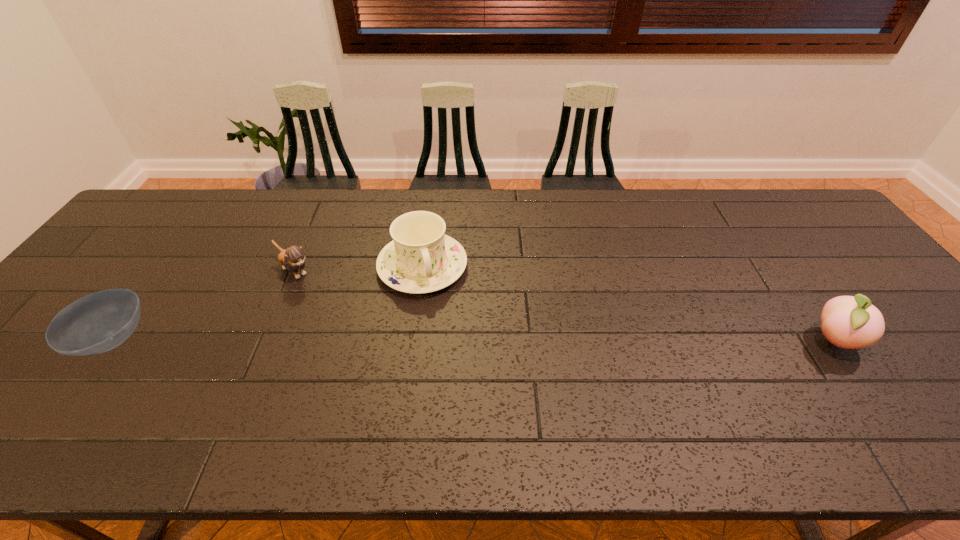
The height and width of the screenshot is (540, 960). What are the coordinates of `free space that is in between the third object from left to right and the kitten` in the screenshot? It's located at (359, 269).

Identify the location of free space between the peach and the kitten. Image resolution: width=960 pixels, height=540 pixels. (564, 306).

Find the location of `object that is the third nearest to the chinaware`. object that is the third nearest to the chinaware is located at coordinates (851, 322).

Select which object is the third closest to the peach. Please provide its 2D coordinates. Your answer should be formatted as a tuple, i.e. [(x, y)], where the tuple contains the x and y coordinates of a point satisfying the conditions above.

[(99, 322)]

Image resolution: width=960 pixels, height=540 pixels. What are the coordinates of `vacant area that satisfies the following two spatial constraints: 1. on the back side of the third object from left to right; 2. on the right side of the leftmost object` in the screenshot? It's located at (166, 267).

At what (x,y) coordinates should I click in order to perform the action: click on free location that satisfies the following two spatial constraints: 1. on the front side of the chinaware; 2. on the left side of the rightmost object. Please return your answer as a coordinate pair (x, y). Looking at the image, I should click on (413, 340).

Find the location of `vacant space that satisfies the following two spatial constraints: 1. on the back side of the leftmost object; 2. on the right side of the chinaware`. vacant space that satisfies the following two spatial constraints: 1. on the back side of the leftmost object; 2. on the right side of the chinaware is located at coordinates tap(166, 267).